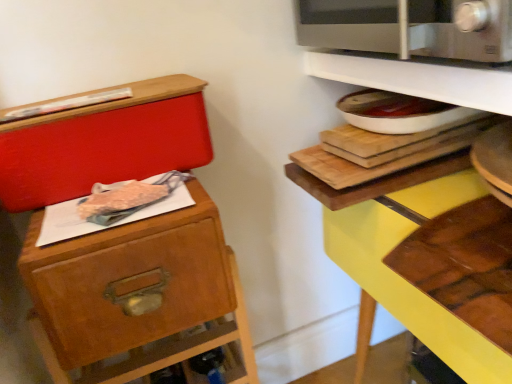
Question: From the image's perspective, relative to white glossy shelf at upper right, positioned as the first shelf in top-to-bottom order, is wooden drawer at left above or below?

Choices:
 (A) below
 (B) above

Answer: (A)

Question: Is wooden drawer at left bigger or smaller than white glossy shelf at upper right, the 2th shelf when ordered from bottom to top?

Choices:
 (A) big
 (B) small

Answer: (A)

Question: Which object is the farthest from the matte red box at upper left?

Choices:
 (A) wooden drawer at left
 (B) satin silver microwave at upper right
 (C) white glossy shelf at upper right, the 2th shelf when ordered from bottom to top
 (D) yellow wood shelf at upper right, which appears as the 1th shelf when ordered from the bottom

Answer: (C)

Question: Which of these objects is positioned farthest from the white glossy shelf at upper right, positioned as the first shelf in top-to-bottom order?

Choices:
 (A) yellow wood shelf at upper right, which ranks as the 2th shelf in top-to-bottom order
 (B) satin silver microwave at upper right
 (C) matte red box at upper left
 (D) wooden drawer at left

Answer: (D)